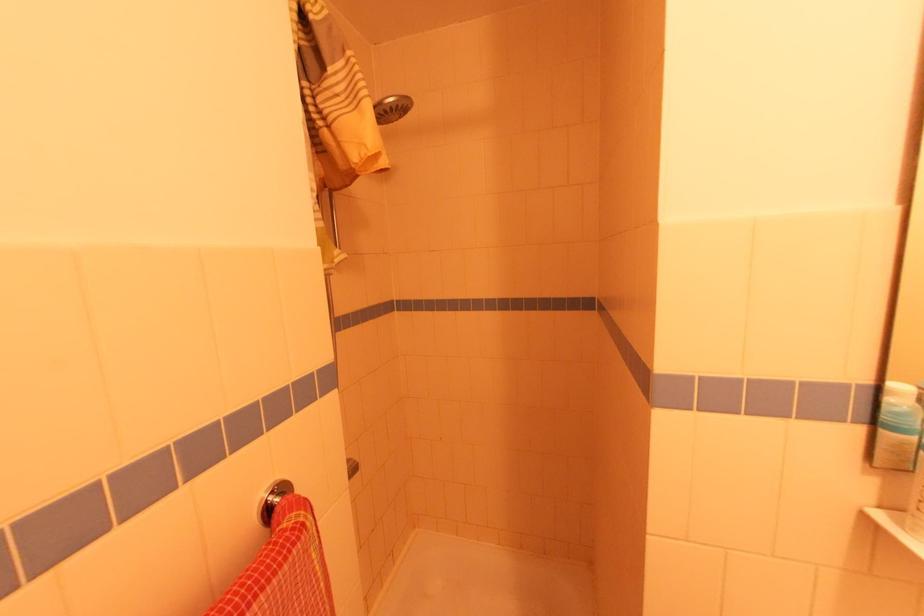
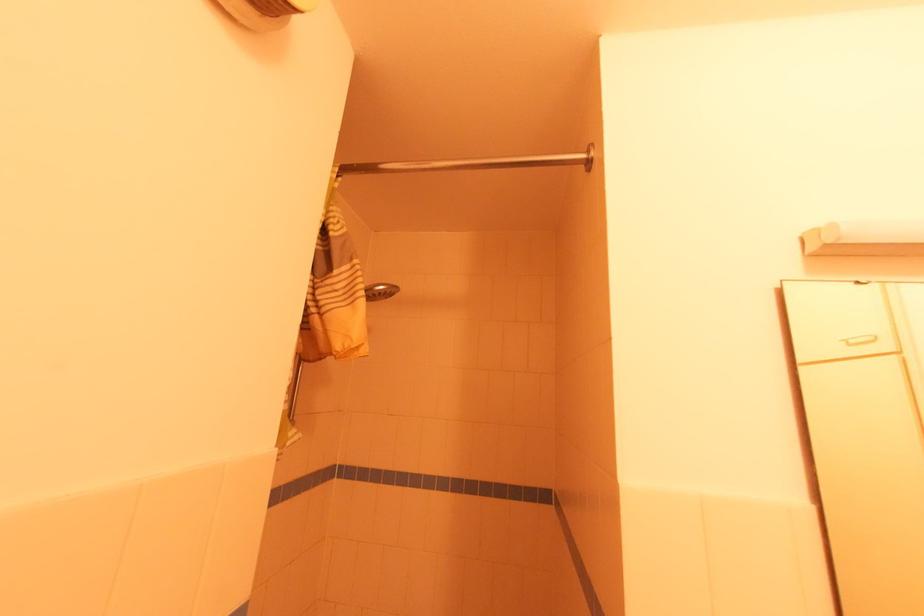
In the second image, find the point that corresponds to the point at 393,100 in the first image.

(383, 288)